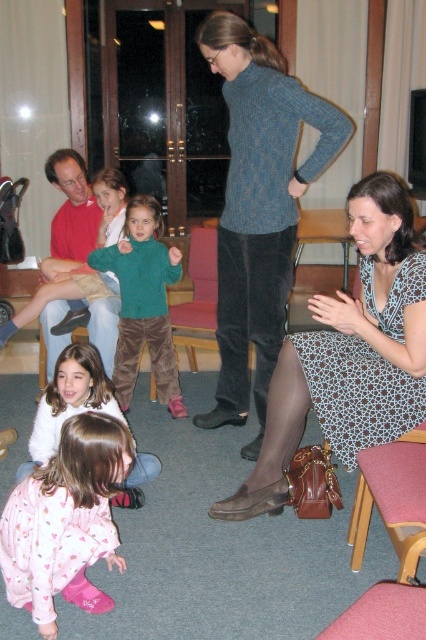
What do you see at coordinates (143, 304) in the screenshot? The image size is (426, 640). I see `green corduroy sweater at center` at bounding box center [143, 304].

The height and width of the screenshot is (640, 426). Find the location of `green corduroy sweater at center`. green corduroy sweater at center is located at coordinates (143, 304).

Between patterned fabric dress at lower right and pink cotton pajamas at lower left, which one is positioned lower?

Positioned lower is pink cotton pajamas at lower left.

Is patterned fabric dress at lower right positioned at the back of pink cotton pajamas at lower left?

Yes, it is.

Is point (382, 310) farther from camera compared to point (81, 419)?

Yes, it is behind point (81, 419).

Image resolution: width=426 pixels, height=640 pixels. What are the coordinates of `patterned fabric dress at lower right` in the screenshot? It's located at (350, 355).

Locate an element on the screen. The width and height of the screenshot is (426, 640). patterned fabric dress at lower right is located at coordinates (350, 355).

Describe the element at coordinates (350, 355) in the screenshot. The height and width of the screenshot is (640, 426). I see `patterned fabric dress at lower right` at that location.

Identify the location of patterned fabric dress at lower right. The height and width of the screenshot is (640, 426). (350, 355).